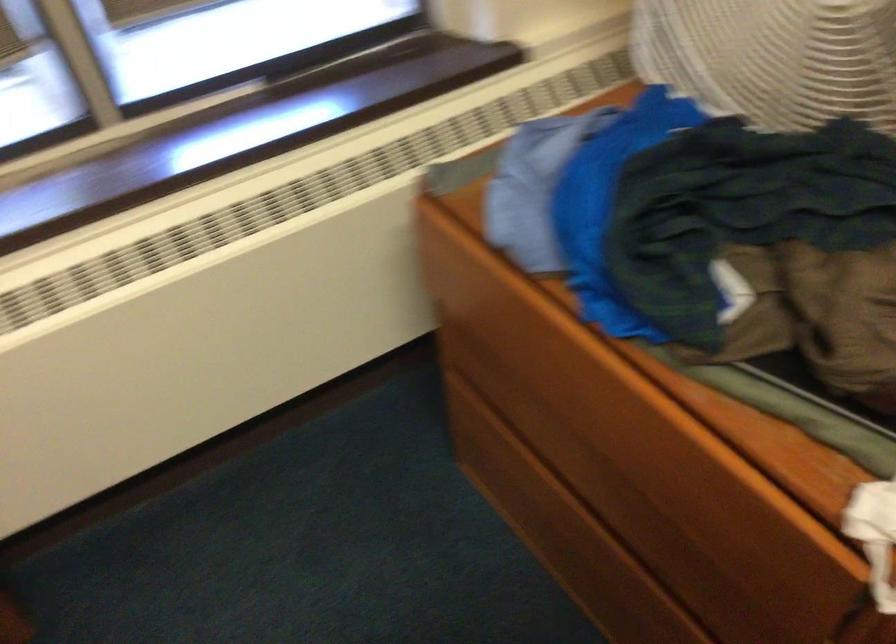
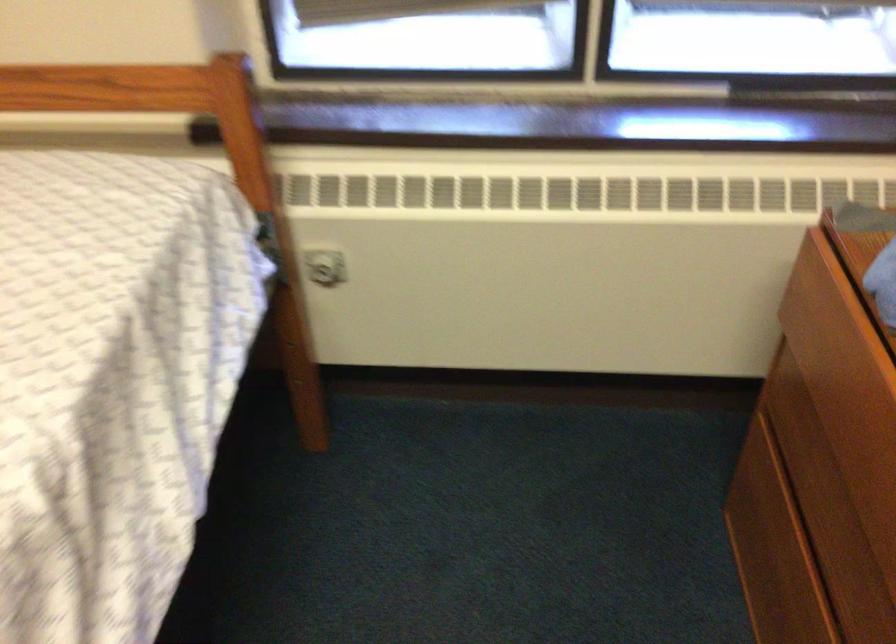
Question: How did the camera likely rotate?

Choices:
 (A) Left
 (B) Right
 (C) Up
 (D) Down

Answer: (A)